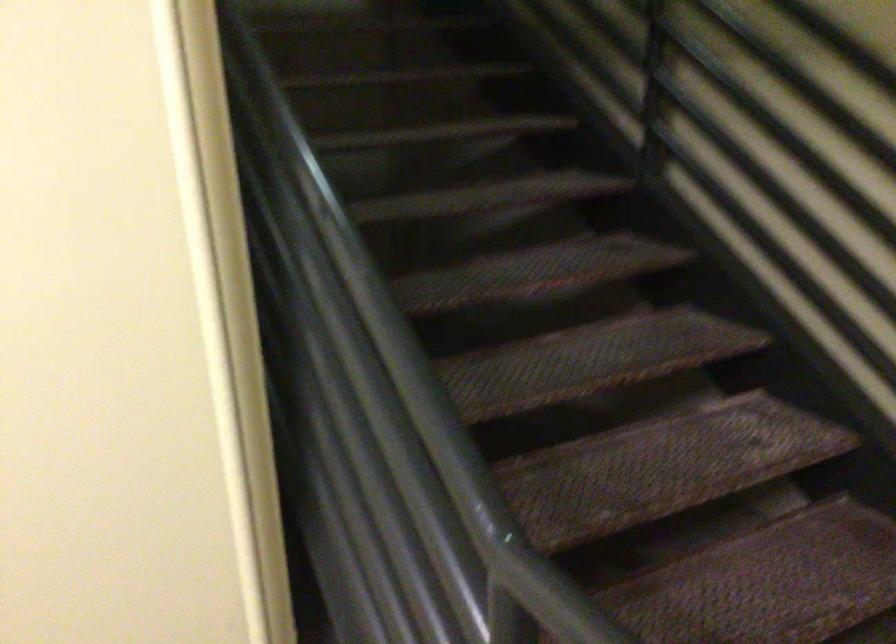
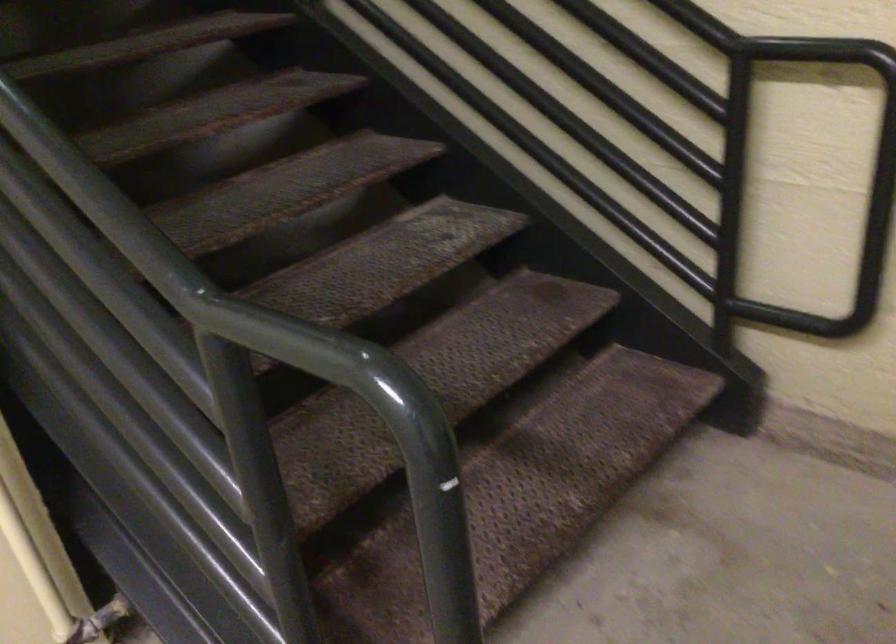
Question: How did the camera likely rotate?

Choices:
 (A) Left
 (B) Right
 (C) Up
 (D) Down

Answer: (B)